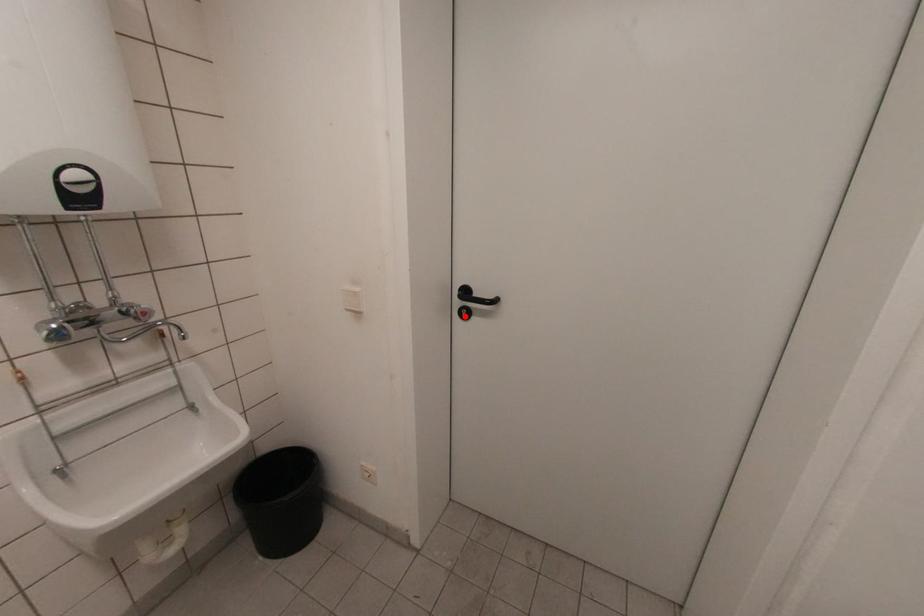
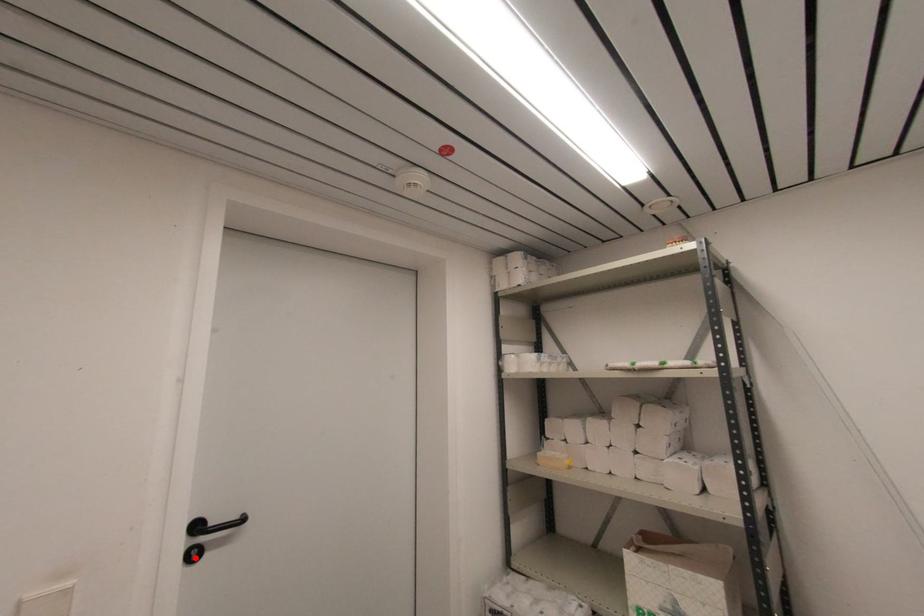
I am providing you with two images of the same scene from different viewpoints. A red point is marked on the first image and another point is marked on the second image. Do the highlighted points in image1 and image2 indicate the same real-world spot?

Yes